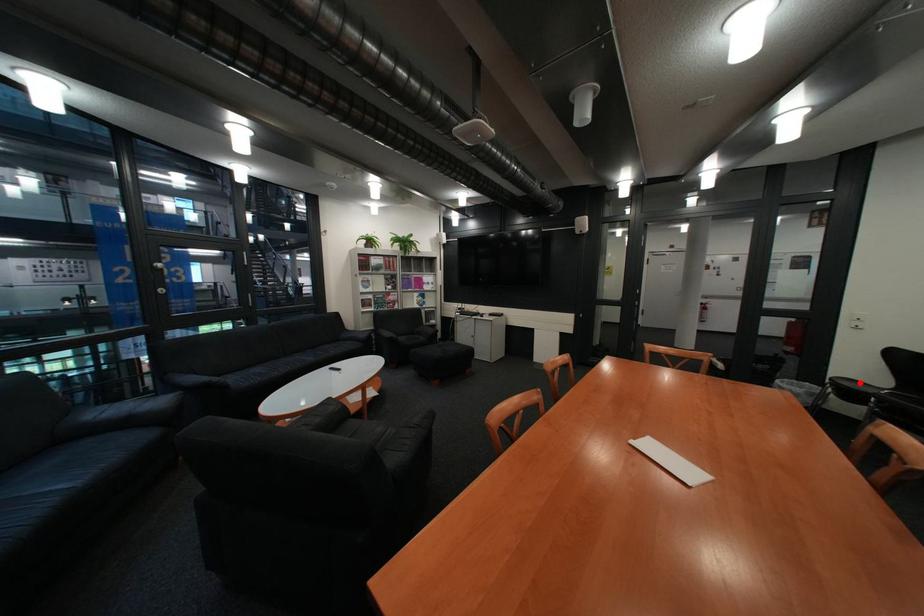
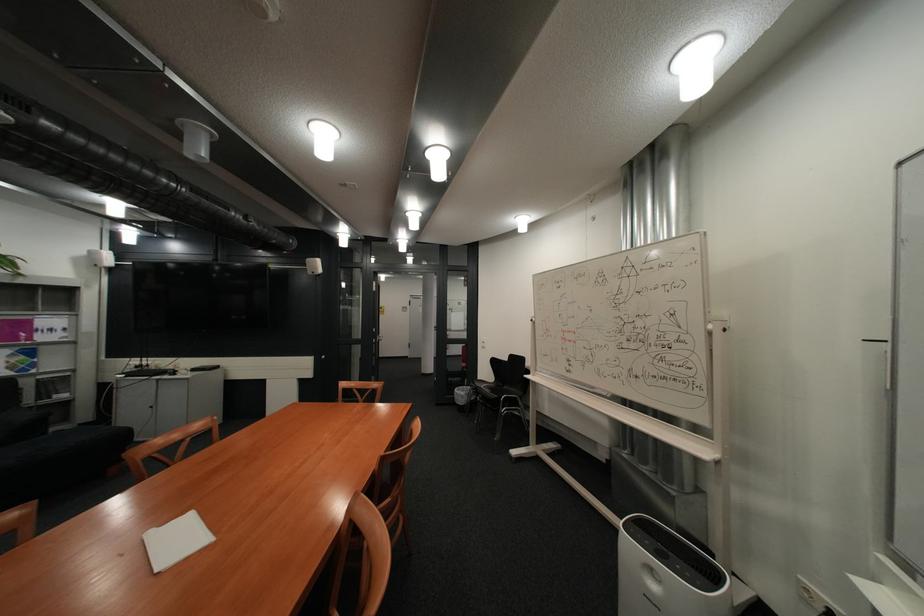
Where in the second image is the point corresponding to the highlighted location from the first image?

(493, 383)